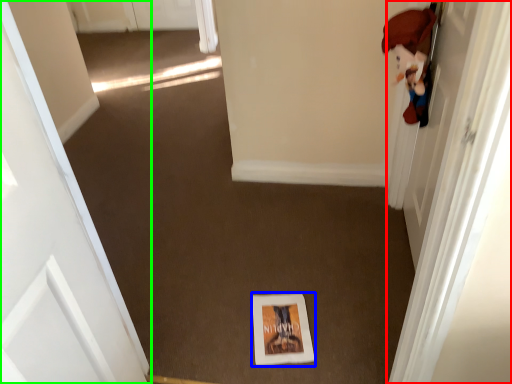
Question: Estimate the real-world distances between objects in this image. Which object is closer to door (highlighted by a red box), print (highlighted by a blue box) or door (highlighted by a green box)?

Choices:
 (A) print
 (B) door

Answer: (A)